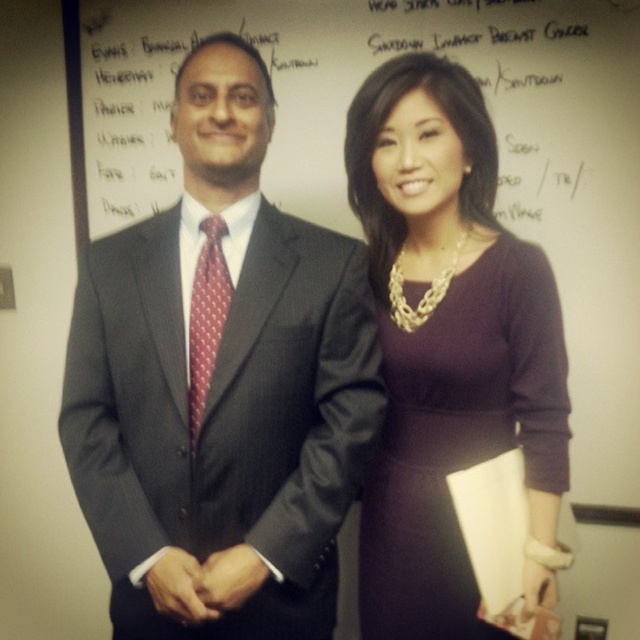
Question: Which point is farther from the camera taking this photo?

Choices:
 (A) (493, 396)
 (B) (589, 179)

Answer: (B)

Question: Considering the relative positions of matte purple dress at center and red dotted tie at center in the image provided, where is matte purple dress at center located with respect to red dotted tie at center?

Choices:
 (A) right
 (B) left

Answer: (A)

Question: Considering the real-world distances, which object is closest to the whiteboard at upper center?

Choices:
 (A) red dotted tie at center
 (B) matte purple dress at center

Answer: (B)

Question: Can you confirm if dark gray suit at center is positioned below matte purple dress at center?

Choices:
 (A) yes
 (B) no

Answer: (B)

Question: Is dark gray suit at center closer to the viewer compared to matte purple dress at center?

Choices:
 (A) yes
 (B) no

Answer: (A)

Question: Which object is the farthest from the matte purple dress at center?

Choices:
 (A) dark gray suit at center
 (B) red dotted tie at center
 (C) whiteboard at upper center

Answer: (C)